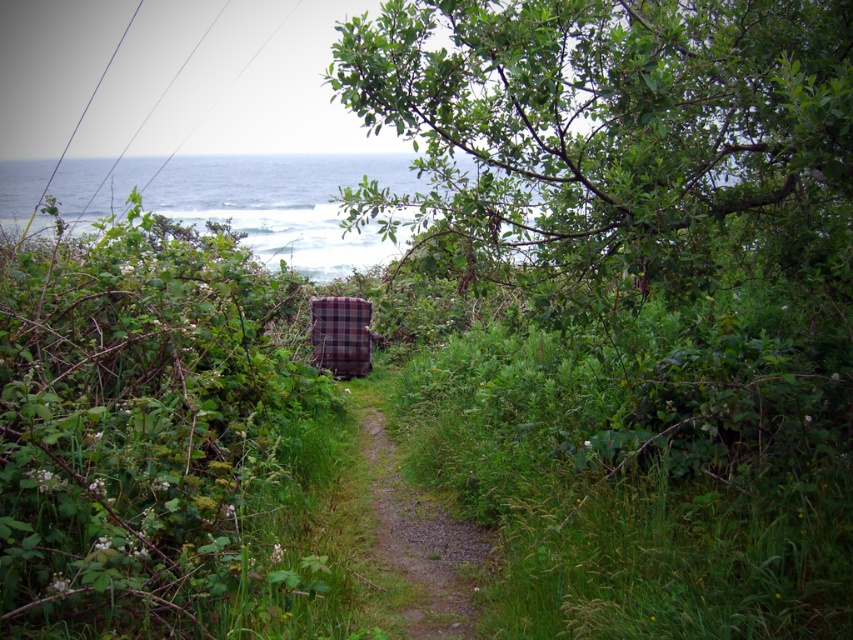
Question: Is green leafy tree at upper center wider than gravelly dirt path at center?

Choices:
 (A) yes
 (B) no

Answer: (A)

Question: Which object is closer to the camera taking this photo?

Choices:
 (A) plaid fabric chair at center
 (B) plaid fabric armchair at center
 (C) green leafy tree at upper center
 (D) gravelly dirt path at center

Answer: (C)

Question: Does green leafy tree at upper center appear on the right side of gravelly dirt path at center?

Choices:
 (A) yes
 (B) no

Answer: (A)

Question: Is green leafy tree at upper center to the left of plaid fabric chair at center from the viewer's perspective?

Choices:
 (A) no
 (B) yes

Answer: (A)

Question: Among these objects, which one is farthest from the camera?

Choices:
 (A) plaid fabric chair at center
 (B) gravelly dirt path at center
 (C) plaid fabric armchair at center
 (D) green leafy tree at upper center

Answer: (C)

Question: Among these objects, which one is nearest to the camera?

Choices:
 (A) plaid fabric armchair at center
 (B) plaid fabric chair at center
 (C) green leafy tree at upper center
 (D) gravelly dirt path at center

Answer: (C)